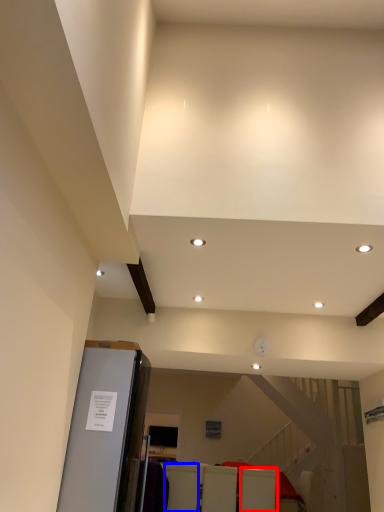
Question: Among these objects, which one is farthest to the camera, furniture (highlighted by a red box) or furniture (highlighted by a blue box)?

Choices:
 (A) furniture
 (B) furniture

Answer: (A)